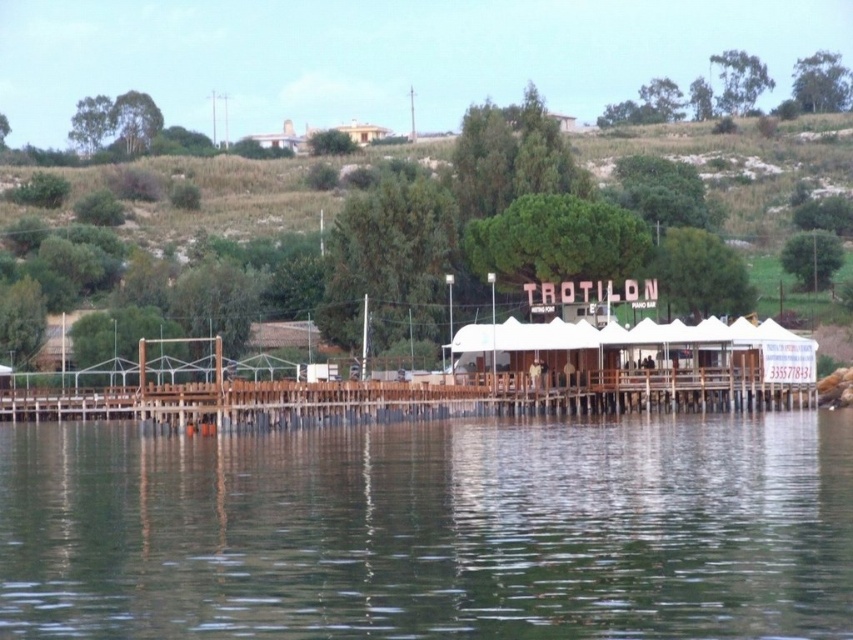
Measure the distance between point (x=827, y=564) and camera.

Point (x=827, y=564) and camera are 34.80 meters apart.

Who is shorter, transparent water at lower center or wooden dock at center?

With less height is transparent water at lower center.

Is point (569, 550) closer to viewer compared to point (161, 401)?

Yes, it is.

At what (x,y) coordinates should I click in order to perform the action: click on transparent water at lower center. Please return your answer as a coordinate pair (x, y). Looking at the image, I should click on (431, 529).